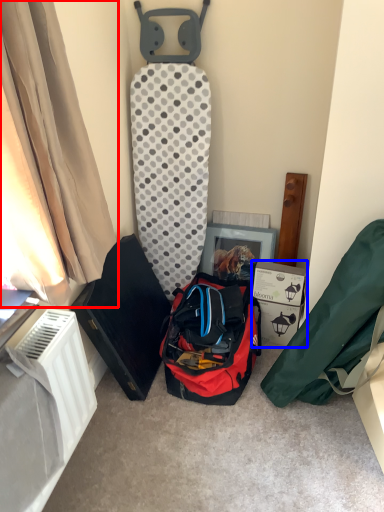
Question: Among these objects, which one is nearest to the camera, curtain (highlighted by a red box) or cardboard box (highlighted by a blue box)?

Choices:
 (A) curtain
 (B) cardboard box

Answer: (A)